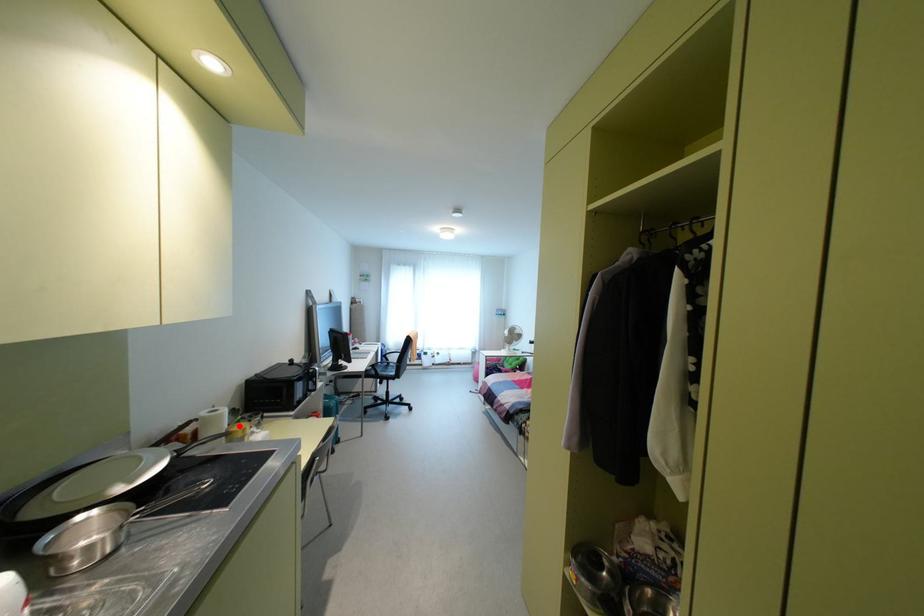
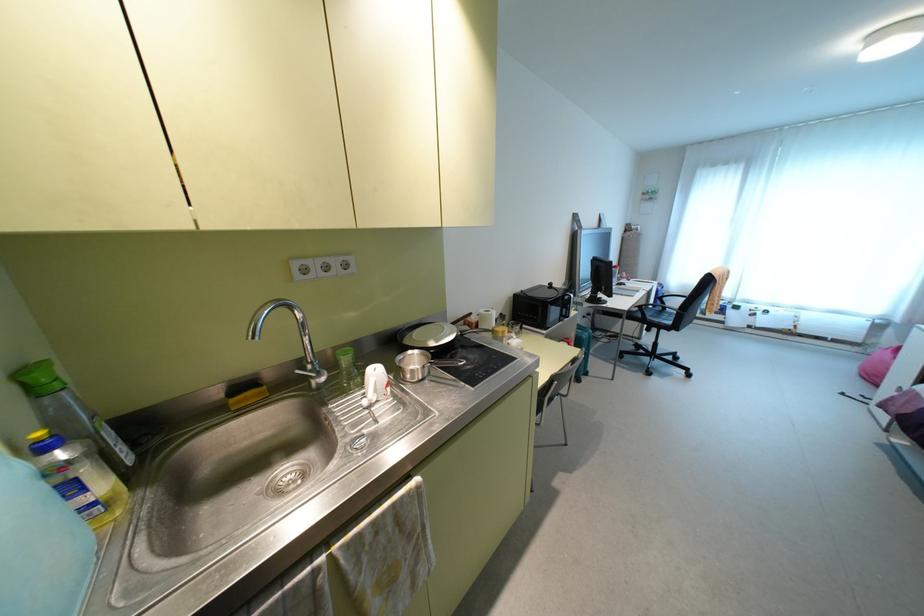
Question: I am providing you with two images of the same scene from different viewpoints. Given a red point in image1, look at the same physical point in image2. Is it:

Choices:
 (A) Closer to the viewpoint
 (B) Farther from the viewpoint

Answer: (B)